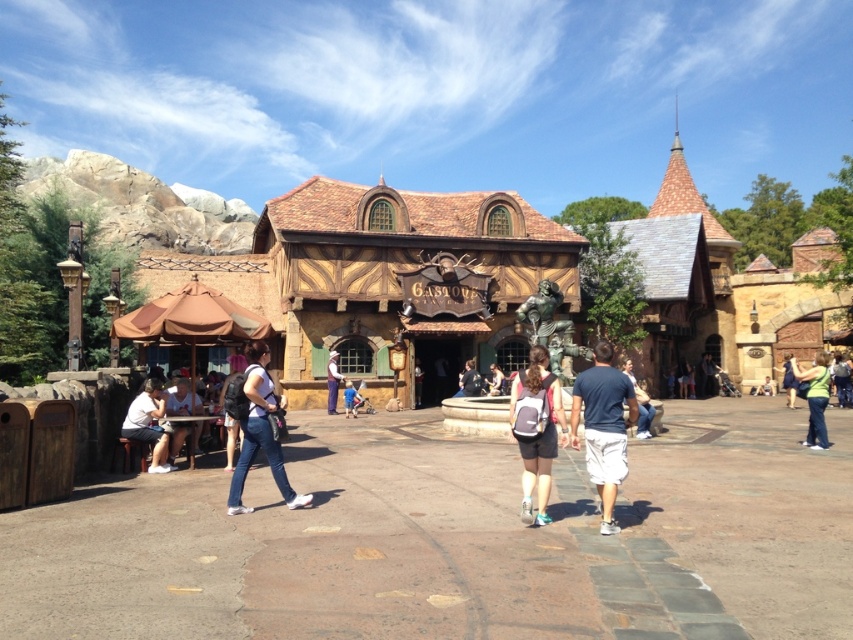
You are standing at the entrance of Gaspar Tavern and see the white cotton shorts at lower right and the white fabric shirt at lower left. Which one is closer to you?

The white cotton shorts at lower right is closer to you because it is in front of the white fabric shirt at lower left.